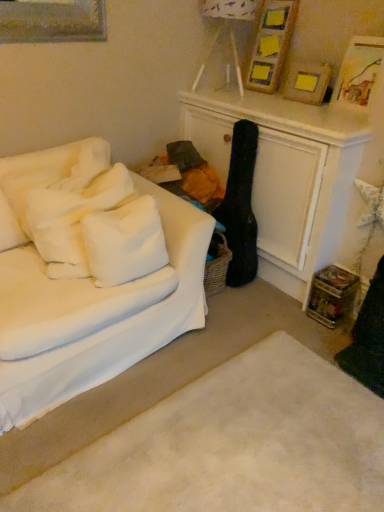
Question: Considering their positions, is wooden frame with yellow squares at upper right, marked as the 1th picture frame in a left-to-right arrangement, located in front of or behind wooden picture frame at upper right, acting as the 2th picture frame starting from the left?

Choices:
 (A) front
 (B) behind

Answer: (B)

Question: Would you say wooden frame with yellow squares at upper right, the third picture frame from the right, is inside or outside wooden picture frame at upper right, which is the second picture frame from right to left?

Choices:
 (A) outside
 (B) inside

Answer: (A)

Question: Estimate the real-world distances between objects in this image. Which object is farther from the wooden picture frame at upper right, which ranks as the 3th picture frame in left-to-right order?

Choices:
 (A) white fluffy pillow at left, which is the second pillow from left to right
 (B) wooden frame with yellow squares at upper right, marked as the 1th picture frame in a left-to-right arrangement
 (C) white fabric couch at left
 (D) white soft pillows at left, positioned as the second pillow in right-to-left order
 (E) wooden picture frame at upper right, which is the second picture frame from right to left

Answer: (D)

Question: Which object is the farthest from the white fabric couch at left?

Choices:
 (A) white soft rug at lower center
 (B) wooden frame with yellow squares at upper right, the third picture frame from the right
 (C) white fluffy pillow at left, the first pillow in the right-to-left sequence
 (D) wooden picture frame at upper right, which ranks as the 3th picture frame in left-to-right order
 (E) white soft pillows at left, the 1th pillow when ordered from left to right

Answer: (B)